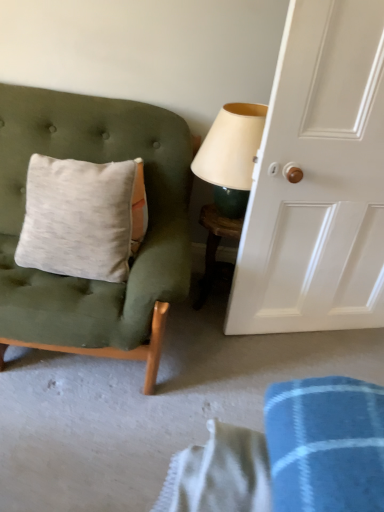
Question: Would you consider white glossy door at right to be distant from matte cream lampshade at upper right?

Choices:
 (A) no
 (B) yes

Answer: (A)

Question: Is the position of white glossy door at right more distant than that of matte cream lampshade at upper right?

Choices:
 (A) yes
 (B) no

Answer: (B)

Question: Is white glossy door at right oriented away from matte cream lampshade at upper right?

Choices:
 (A) no
 (B) yes

Answer: (B)

Question: Does white glossy door at right contain matte cream lampshade at upper right?

Choices:
 (A) no
 (B) yes

Answer: (A)

Question: Does white glossy door at right have a lesser height compared to matte cream lampshade at upper right?

Choices:
 (A) no
 (B) yes

Answer: (A)

Question: In the image, is matte cream lampshade at upper right on the left side or the right side of velvet green chair at left?

Choices:
 (A) right
 (B) left

Answer: (A)

Question: Choose the correct answer: Is matte cream lampshade at upper right inside velvet green chair at left or outside it?

Choices:
 (A) outside
 (B) inside

Answer: (A)

Question: In the image, is matte cream lampshade at upper right positioned in front of or behind velvet green chair at left?

Choices:
 (A) front
 (B) behind

Answer: (B)

Question: Based on their sizes in the image, would you say matte cream lampshade at upper right is bigger or smaller than velvet green chair at left?

Choices:
 (A) big
 (B) small

Answer: (B)

Question: Based on their sizes in the image, would you say white glossy door at right is bigger or smaller than velvet green chair at left?

Choices:
 (A) big
 (B) small

Answer: (A)

Question: Considering their positions, is white glossy door at right located in front of or behind velvet green chair at left?

Choices:
 (A) behind
 (B) front

Answer: (B)

Question: From a real-world perspective, relative to velvet green chair at left, is white glossy door at right vertically above or below?

Choices:
 (A) below
 (B) above

Answer: (B)

Question: From the image's perspective, is white glossy door at right above or below velvet green chair at left?

Choices:
 (A) below
 (B) above

Answer: (B)

Question: From their relative heights in the image, would you say velvet green chair at left is taller or shorter than matte cream lampshade at upper right?

Choices:
 (A) tall
 (B) short

Answer: (A)

Question: From the image's perspective, is velvet green chair at left located above or below matte cream lampshade at upper right?

Choices:
 (A) above
 (B) below

Answer: (B)